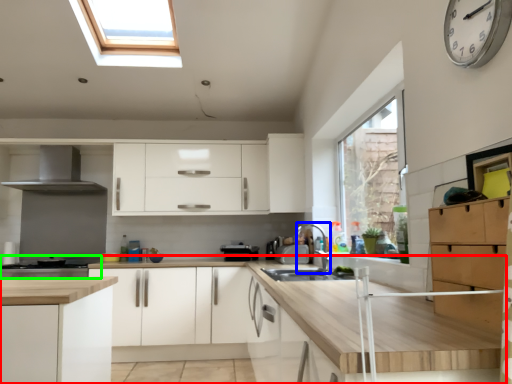
Question: Which is nearer to the countertop (highlighted by a red box)? faucet (highlighted by a blue box) or home appliance (highlighted by a green box).

Choices:
 (A) faucet
 (B) home appliance

Answer: (A)